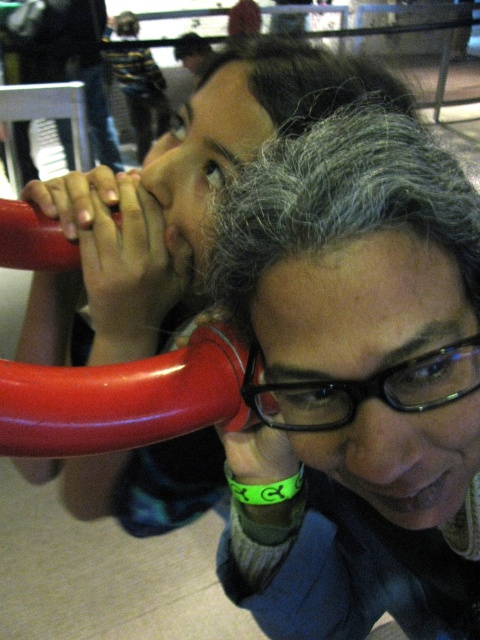
Who is more forward, [453,221] or [27,404]?

Point [453,221] is more forward.

Is point (327, 506) positioned in front of point (96, 448)?

No, it is behind (96, 448).

The image size is (480, 640). Find the location of `gray hair at center`. gray hair at center is located at coordinates (354, 381).

Is matte black hair at center taller than glossy red handlebar at lower center?

Indeed, matte black hair at center has a greater height compared to glossy red handlebar at lower center.

What do you see at coordinates (178, 198) in the screenshot?
I see `matte black hair at center` at bounding box center [178, 198].

You are a GUI agent. You are given a task and a screenshot of the screen. Output one action in this format:
    pyautogui.click(x=<x>, y=<y>)
    Task: Click on the matte black hair at center
    Image resolution: width=480 pixels, height=640 pixels.
    Given the screenshot: What is the action you would take?
    pyautogui.click(x=178, y=198)

The width and height of the screenshot is (480, 640). What do you see at coordinates (354, 381) in the screenshot?
I see `gray hair at center` at bounding box center [354, 381].

Is gray hair at center to the left of matte black hair at center from the viewer's perspective?

In fact, gray hair at center is to the right of matte black hair at center.

Where is `gray hair at center`? gray hair at center is located at coordinates (354, 381).

Where is `gray hair at center`? Image resolution: width=480 pixels, height=640 pixels. gray hair at center is located at coordinates (354, 381).